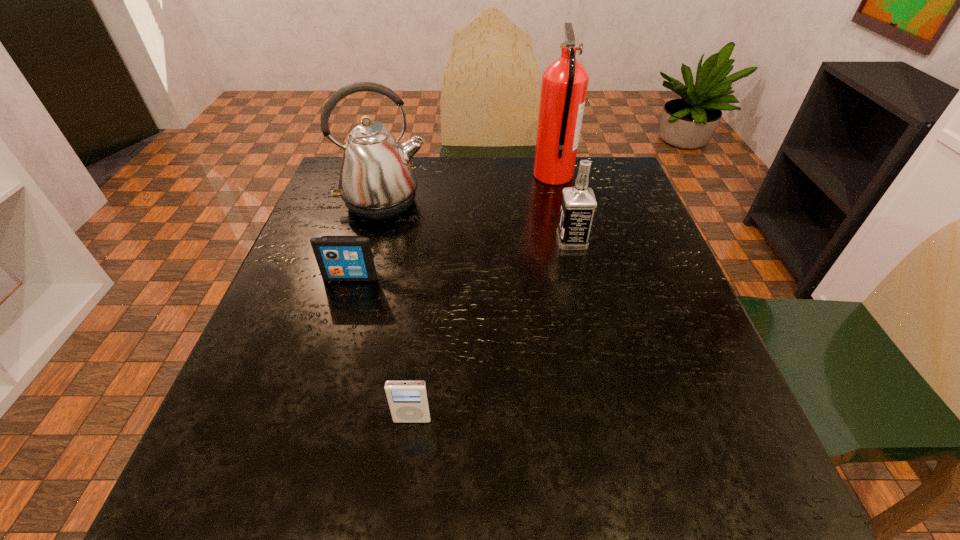
I want to click on blank space located 0.080m at the nozzle of the fire extinguisher, so click(504, 176).

Identify the location of free location located 0.140m on the front of the second tallest object. The height and width of the screenshot is (540, 960). (367, 266).

At what (x,y) coordinates should I click in order to perform the action: click on vacant space located 0.200m on the front label of the third shortest object. Please return your answer as a coordinate pair (x, y). This screenshot has width=960, height=540. Looking at the image, I should click on (469, 241).

The width and height of the screenshot is (960, 540). What are the coordinates of `free space located 0.180m on the front label of the third shortest object` in the screenshot? It's located at (478, 241).

Identify the location of free region located 0.130m on the front label of the third shortest object. (500, 241).

Image resolution: width=960 pixels, height=540 pixels. Identify the location of blank area located on the front screen of the farther iPod. (296, 460).

At what (x,y) coordinates should I click in order to perform the action: click on vacant position located 0.130m on the front-facing side of the nearest object. Please return your answer as a coordinate pair (x, y). The height and width of the screenshot is (540, 960). Looking at the image, I should click on (401, 514).

The height and width of the screenshot is (540, 960). I want to click on fire extinguisher located in the far edge section of the desktop, so [x=564, y=85].

Locate an element on the screen. Image resolution: width=960 pixels, height=540 pixels. kettle located in the far edge section of the desktop is located at coordinates (376, 182).

You are a GUI agent. You are given a task and a screenshot of the screen. Output one action in this format:
    pyautogui.click(x=<x>, y=<y>)
    Task: Click on the kettle located at the left edge
    This screenshot has height=540, width=960.
    Given the screenshot: What is the action you would take?
    pyautogui.click(x=376, y=182)